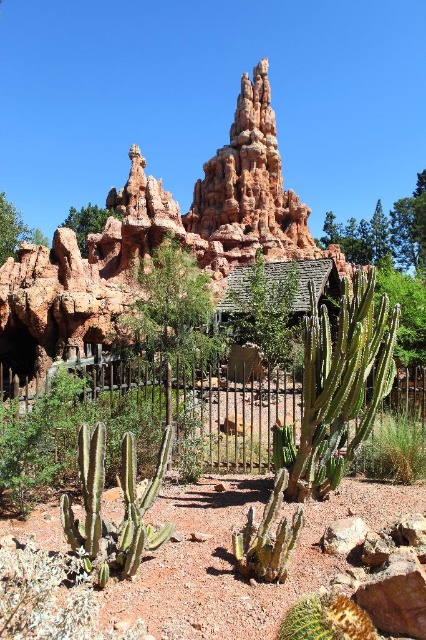
Question: Can you confirm if green spiky cactus at center is positioned above rusty corrugated metal hut at center?

Choices:
 (A) yes
 (B) no

Answer: (B)

Question: Does green leafy bush at center lie behind green spiky cactus at center?

Choices:
 (A) no
 (B) yes

Answer: (B)

Question: Is iron wire fence at center above green spiny cactus at lower left?

Choices:
 (A) yes
 (B) no

Answer: (A)

Question: Estimate the real-world distances between objects in this image. Which object is closer to the iron wire fence at center?

Choices:
 (A) rusty corrugated metal hut at center
 (B) rustic stone rock formation at upper center

Answer: (A)

Question: Among these points, which one is nearest to the camera?

Choices:
 (A) (422, 472)
 (B) (273, 484)
 (C) (252, 99)
 (D) (89, 224)

Answer: (A)

Question: Estimate the real-world distances between objects in this image. Which object is closer to the iron wire fence at center?

Choices:
 (A) green leafy bush at center
 (B) rustic stone rock formation at upper center

Answer: (A)